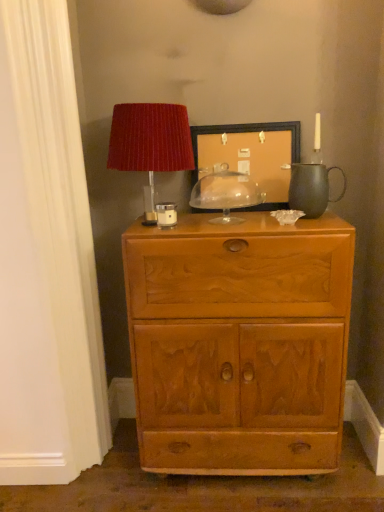
At what (x,y) coordinates should I click in order to perform the action: click on free space above light brown wood chest of drawers at center (from a real-world perspective). Please return your answer as a coordinate pair (x, y). Looking at the image, I should click on (231, 211).